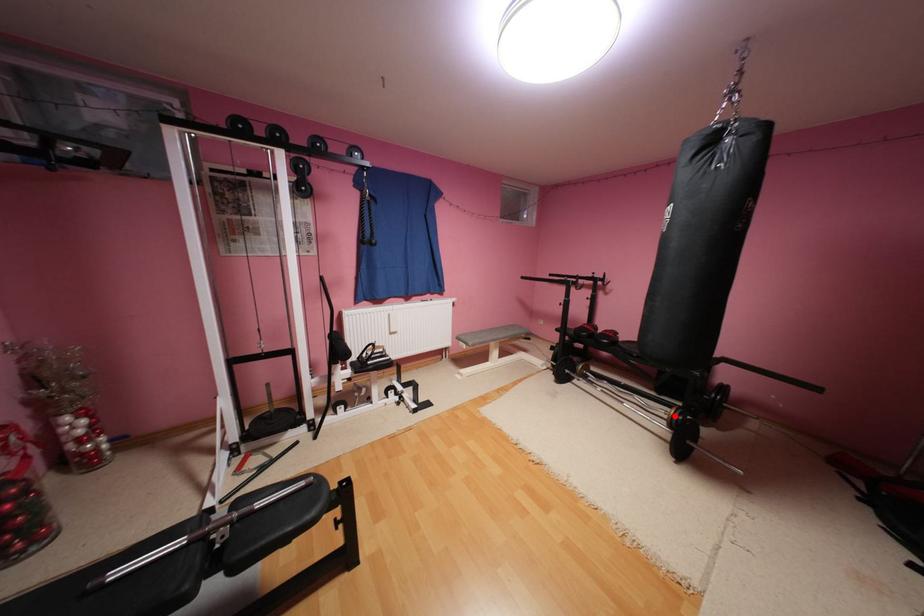
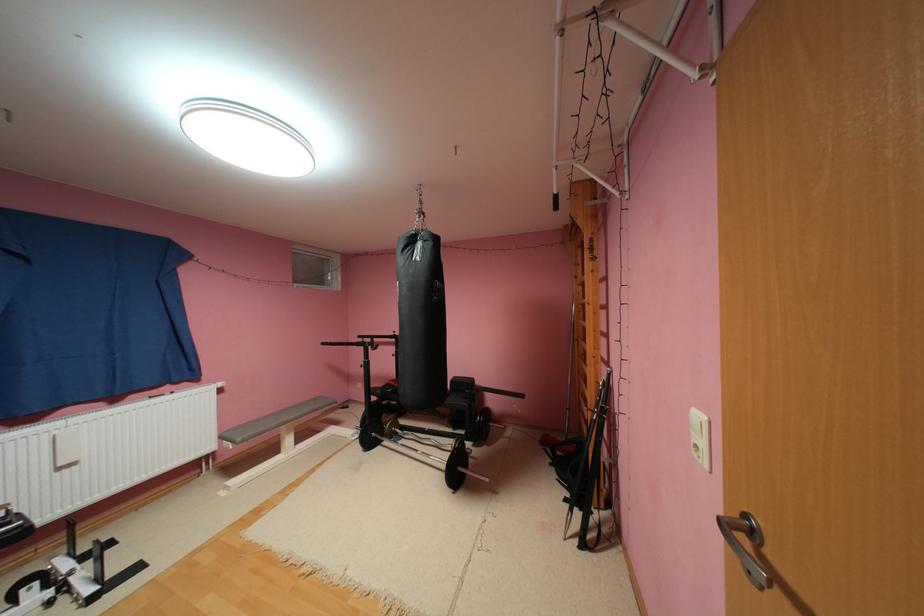
Locate, in the second image, the point that corresponds to the highlighted location in the first image.

(458, 450)